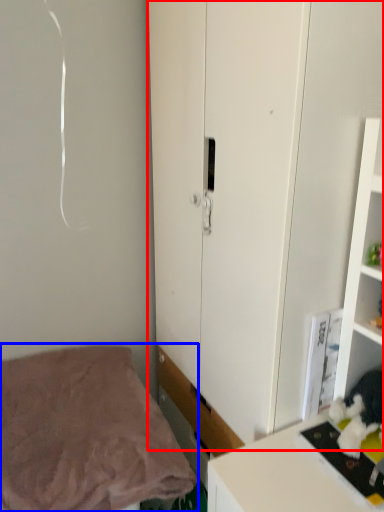
Question: Which object is closer to the camera taking this photo, cupboard (highlighted by a red box) or bed (highlighted by a blue box)?

Choices:
 (A) cupboard
 (B) bed

Answer: (A)